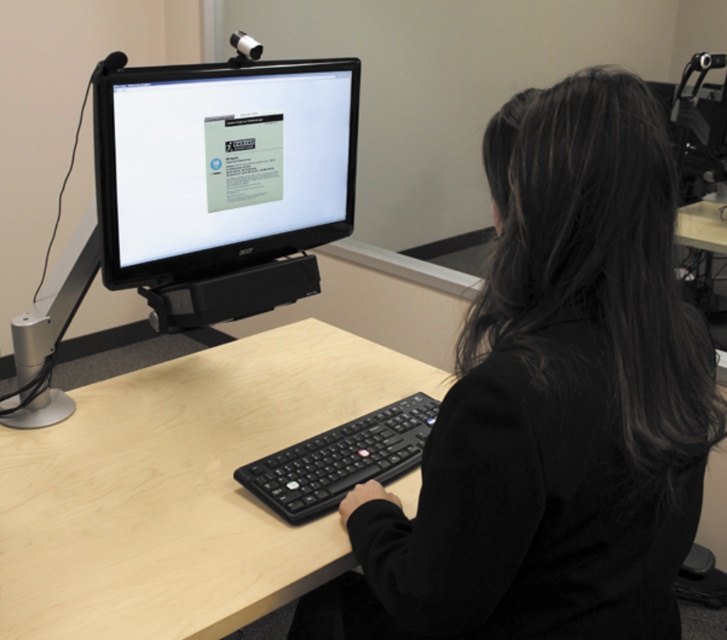
You are setting up a new desk and want to place the matte black monitor at center and the black plastic keyboard at center. Since the monitor is wider than the keyboard, how should you arrange them to ensure both fit on the desk without overlapping?

A: Since the matte black monitor at center is wider than the black plastic keyboard at center, place the matte black monitor at center on the left side of the desk and position the black plastic keyboard at center to its right. This arrangement ensures the wider monitor occupies more space on the left, allowing the keyboard to fit neatly to its right without overlapping.

You are setting up a new desk arrangement and want to place a mouse next to the black matte keyboard at center so that it is between the keyboard and the matte black monitor at center. Is this possible based on their current positions?

The black matte keyboard at center is to the right of the matte black monitor at center, so placing the mouse between them would require positioning it to the left of the keyboard and to the right of the monitor, which is feasible based on their current arrangement.